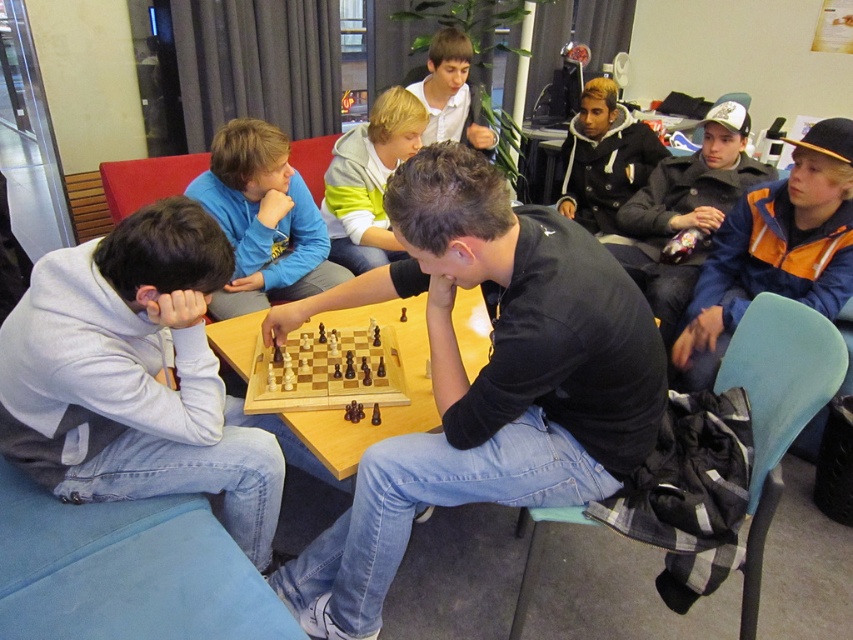
Find the location of a particular element. This screenshot has width=853, height=640. gray fleece hoodie at left is located at coordinates (132, 376).

Is gray fleece hoodie at left to the right of light gray hoodie at center from the viewer's perspective?

Incorrect, gray fleece hoodie at left is not on the right side of light gray hoodie at center.

Between point (190, 364) and point (378, 140), which one is positioned behind?

Point (378, 140)

You are a GUI agent. You are given a task and a screenshot of the screen. Output one action in this format:
    pyautogui.click(x=<x>, y=<y>)
    Task: Click on the gray fleece hoodie at left
    The height and width of the screenshot is (640, 853).
    Given the screenshot: What is the action you would take?
    pyautogui.click(x=132, y=376)

Between point (207, 177) and point (399, 138), which one is positioned in front?

Point (207, 177) is in front.

At what (x,y) coordinates should I click in order to perform the action: click on blue fleece jacket at upper left. Please return your answer as a coordinate pair (x, y). Looking at the image, I should click on (263, 220).

Identify the location of blue fleece jacket at upper left. (263, 220).

Does black matte shirt at center appear under light gray hoodie at center?

Correct, black matte shirt at center is located below light gray hoodie at center.

Find the location of a particular element. black matte shirt at center is located at coordinates (485, 378).

Image resolution: width=853 pixels, height=640 pixels. Identify the location of black matte shirt at center. (485, 378).